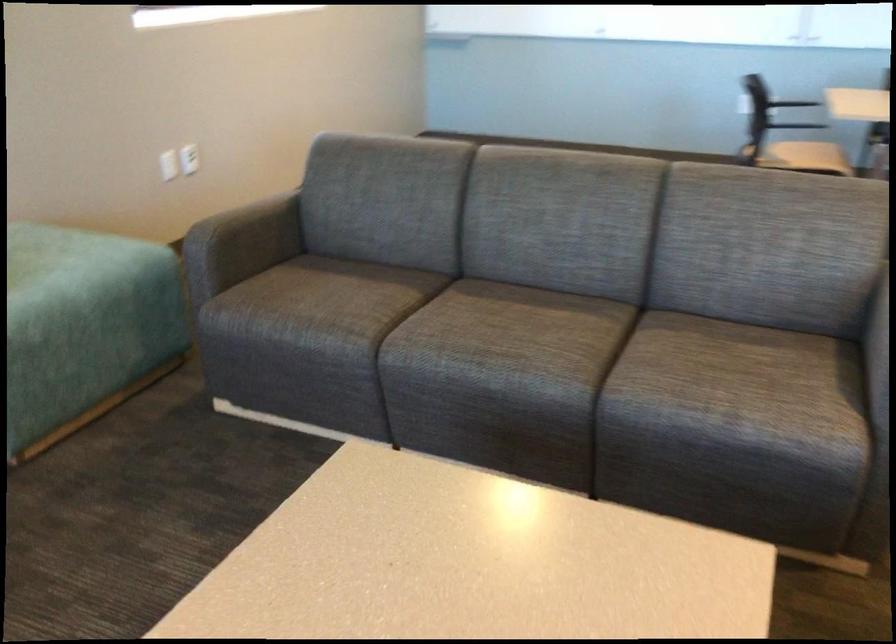
Where is `grey sofa sitting surface`? The width and height of the screenshot is (896, 644). grey sofa sitting surface is located at coordinates (358, 343).